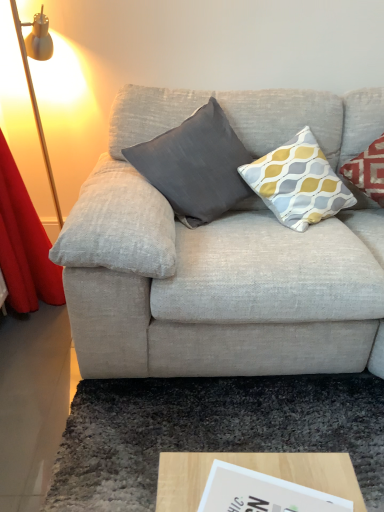
Locate an element on the screen. This screenshot has width=384, height=512. free region under gold metallic floor lamp at left (from a real-world perspective) is located at coordinates (31, 322).